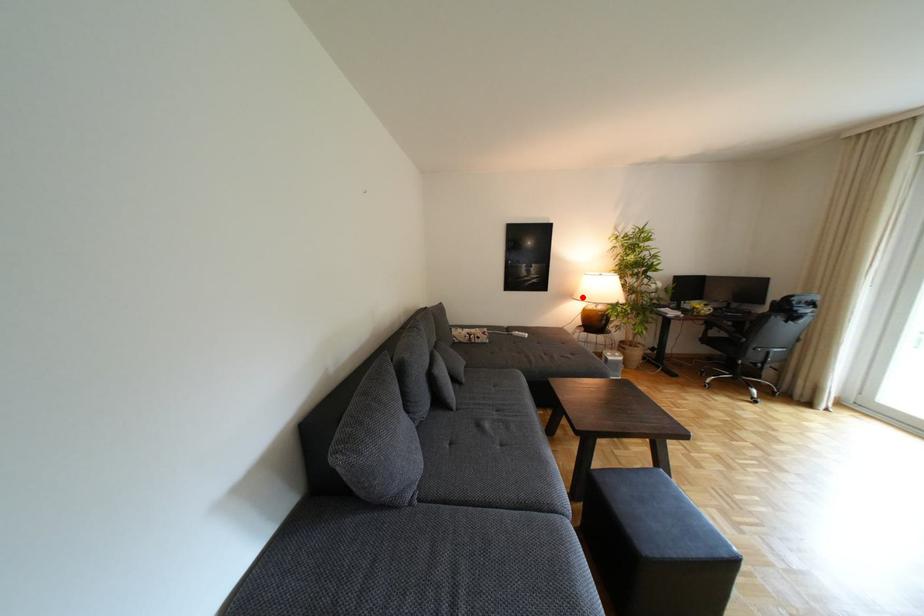
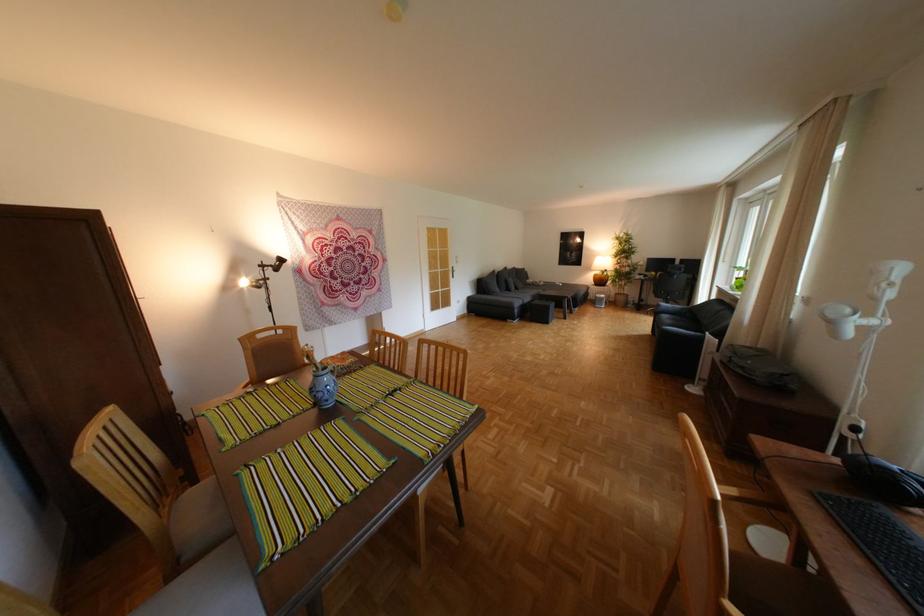
Question: I am providing you with two images of the same scene from different viewpoints. A red point is marked on the first image. At the location where the point appears in image 1, is it still visible in image 2?

Choices:
 (A) Yes
 (B) No

Answer: (A)